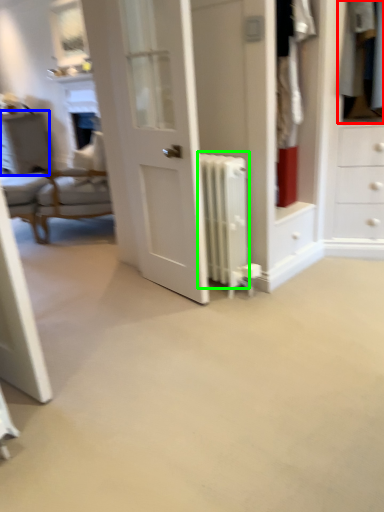
Question: Considering the real-world distances, which object is closest to clothing (highlighted by a red box)? vanity (highlighted by a blue box) or radiator (highlighted by a green box).

Choices:
 (A) vanity
 (B) radiator

Answer: (B)